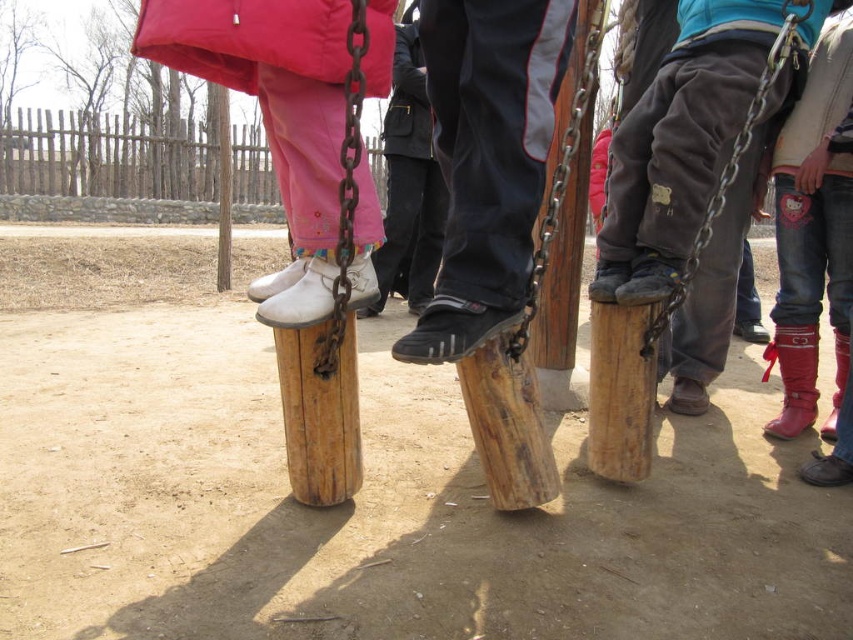
Question: Can you confirm if black leather shoe at center is wider than red leather boots at lower right?

Choices:
 (A) no
 (B) yes

Answer: (A)

Question: Is matte pink pants at left smaller than red leather boots at lower right?

Choices:
 (A) yes
 (B) no

Answer: (A)

Question: Which point is farther from the camera taking this photo?

Choices:
 (A) (474, 154)
 (B) (799, 108)

Answer: (B)

Question: Considering the real-world distances, which object is farthest from the dark gray fabric pants at center?

Choices:
 (A) matte pink pants at left
 (B) black leather shoe at center
 (C) red leather boots at lower right

Answer: (B)

Question: Estimate the real-world distances between objects in this image. Which object is farther from the black leather shoe at center?

Choices:
 (A) matte pink pants at left
 (B) wooden post at center
 (C) red leather boots at lower right

Answer: (C)

Question: Can you confirm if wooden post at center is wider than dark gray fabric pants at center?

Choices:
 (A) yes
 (B) no

Answer: (B)